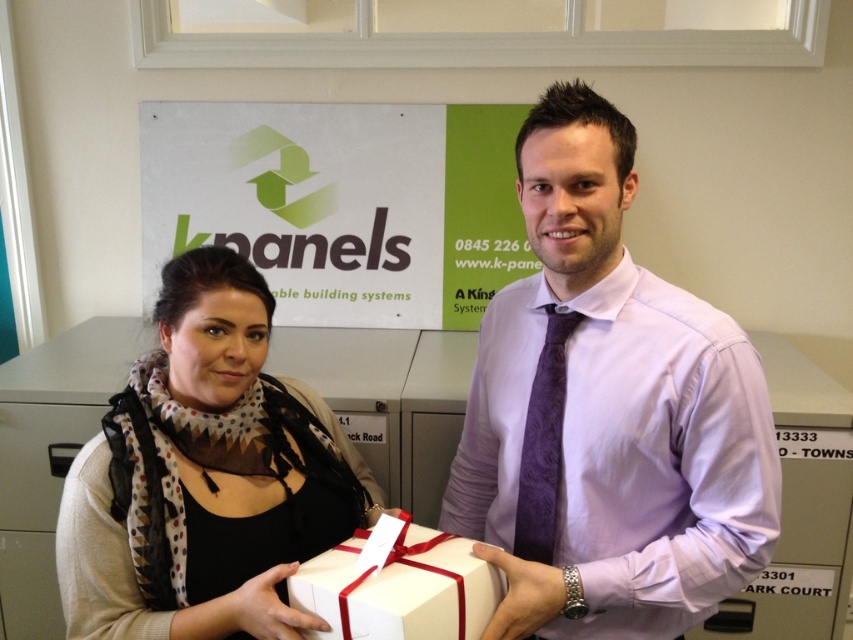
In the scene shown: You are a delivery person who needs to check if the black scarf at center can be placed under the green matte signboard at upper center without touching the top edge. Based on their heights, can it fit?

The black scarf at center is not as tall as the green matte signboard at upper center. Therefore, the black scarf at center can be placed under the green matte signboard at upper center without touching the top edge since it is shorter.

You are an office assistant who needs to hang a new poster on the wall where the green matte signboard at upper center and the white matte gift box at center are currently displayed. The poster requires 2 meters of vertical space. Can you hang it between them?

The green matte signboard at upper center is positioned over the white matte gift box at center, meaning there is no vertical space between them. Therefore, you cannot hang the poster requiring 2 meters of vertical space between them.